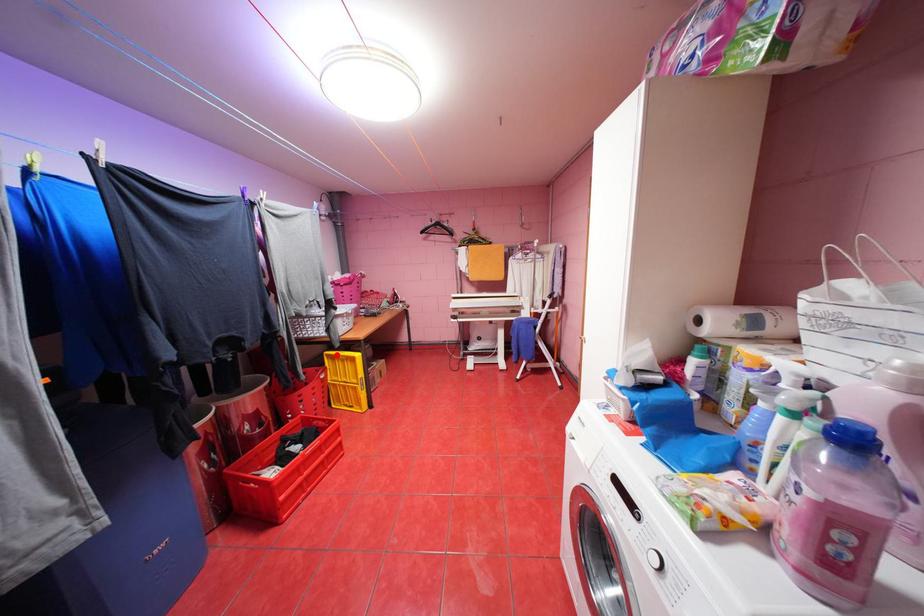
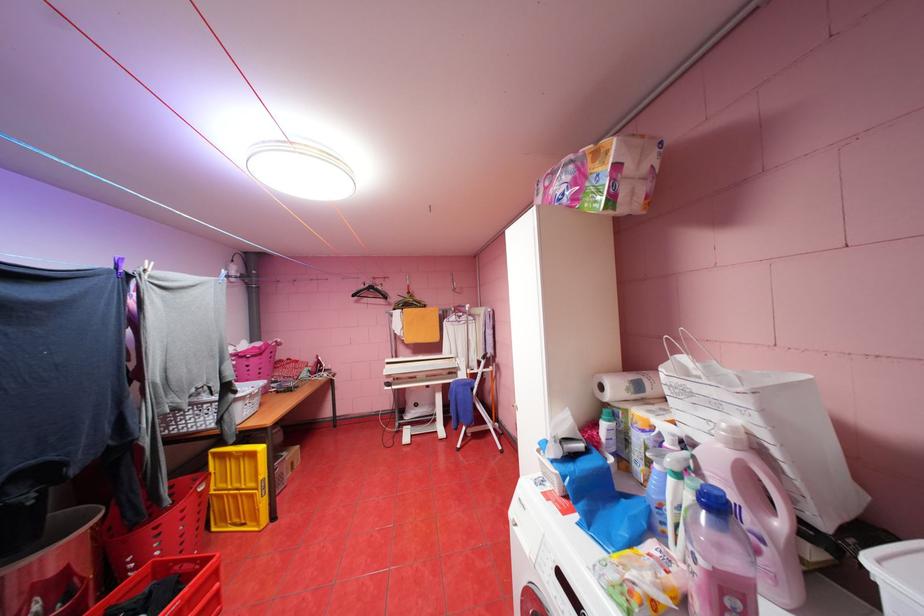
The point at the highlighted location is marked in the first image. Where is the corresponding point in the second image?

(224, 454)